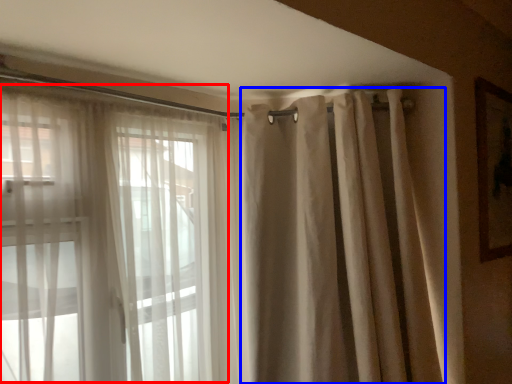
Question: Among these objects, which one is farthest to the camera, bay window (highlighted by a red box) or shower curtain (highlighted by a blue box)?

Choices:
 (A) bay window
 (B) shower curtain

Answer: (B)